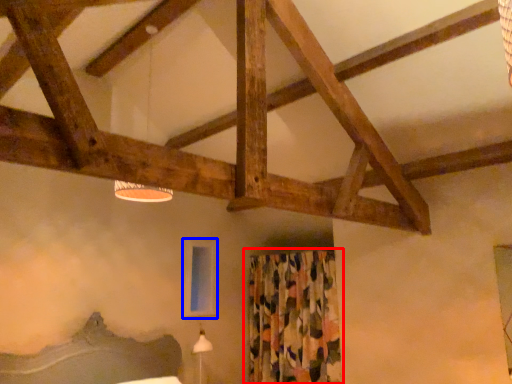
Question: Which point is further to the camera, curtain (highlighted by a red box) or window screen (highlighted by a blue box)?

Choices:
 (A) curtain
 (B) window screen

Answer: (B)